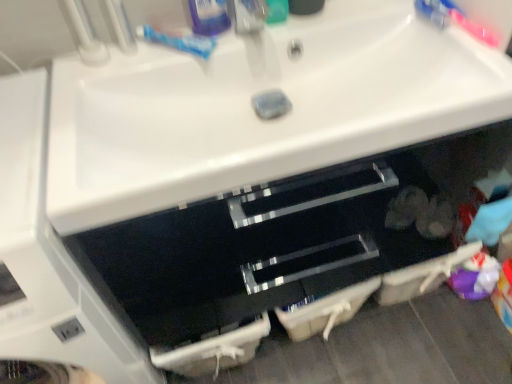
Identify the location of vacant area that is situated to the right of blue matte toothpaste at upper center. The image size is (512, 384). (254, 39).